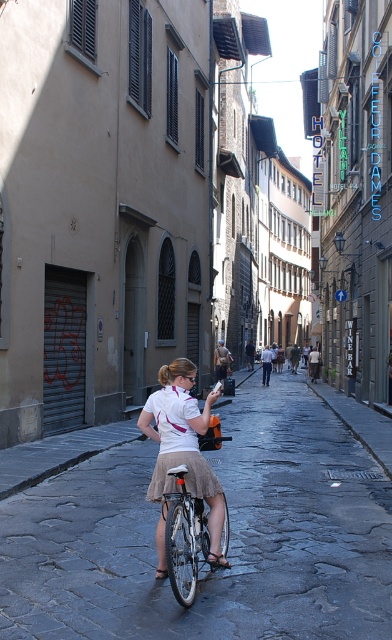
Question: Is white fabric skirt at center further to camera compared to silver metallic bicycle at center?

Choices:
 (A) no
 (B) yes

Answer: (A)

Question: Which of the following is the farthest from the observer?

Choices:
 (A) silver metallic bicycle at center
 (B) white matte skirt at center
 (C) white fabric skirt at center

Answer: (B)

Question: Is white fabric skirt at center closer to the viewer compared to white matte skirt at center?

Choices:
 (A) no
 (B) yes

Answer: (B)

Question: Estimate the real-world distances between objects in this image. Which object is farther from the silver metallic bicycle at center?

Choices:
 (A) white matte skirt at center
 (B) white fabric skirt at center

Answer: (B)

Question: Which of the following is the closest to the observer?

Choices:
 (A) white matte skirt at center
 (B) white fabric skirt at center
 (C) silver metallic bicycle at center

Answer: (B)

Question: Is white fabric skirt at center to the right of white matte skirt at center from the viewer's perspective?

Choices:
 (A) yes
 (B) no

Answer: (A)